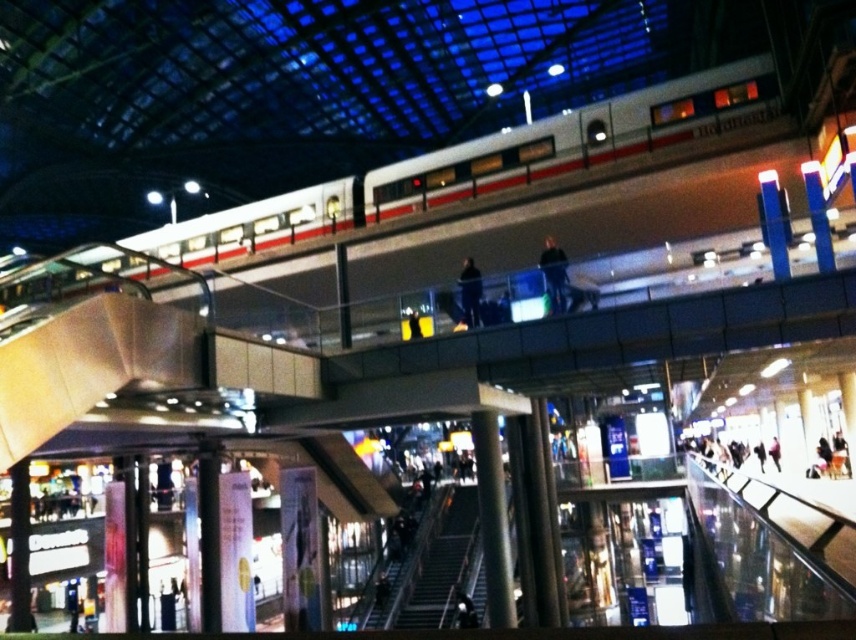
Question: Does white glossy train at upper center appear over dark blue fabric jacket at upper center?

Choices:
 (A) no
 (B) yes

Answer: (B)

Question: Can you confirm if white glossy train at upper center is wider than dark blue fabric at upper center?

Choices:
 (A) yes
 (B) no

Answer: (A)

Question: Does white glossy train at upper center appear on the left side of dark blue fabric at upper center?

Choices:
 (A) no
 (B) yes

Answer: (B)

Question: Which of the following is the closest to the observer?

Choices:
 (A) dark blue fabric jacket at upper center
 (B) dark blue fabric at upper center

Answer: (A)

Question: Which point is closer to the camera taking this photo?

Choices:
 (A) (206, 220)
 (B) (550, 257)

Answer: (B)

Question: Which point is farther from the camera taking this photo?

Choices:
 (A) (24, 280)
 (B) (479, 316)

Answer: (B)